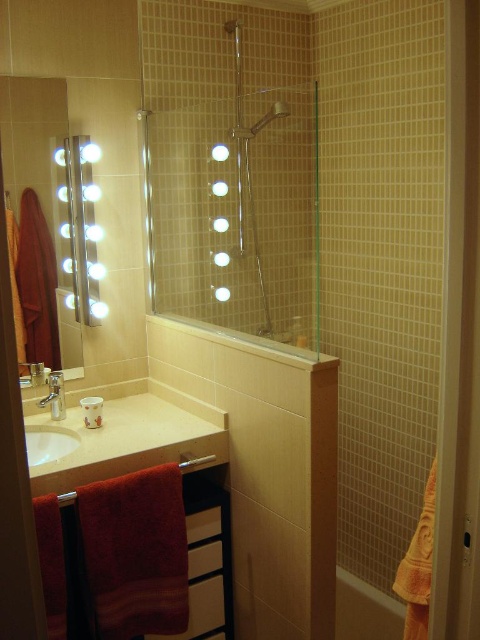
Which is below, white glossy bath at lower right or brushed metal faucet at sink left?

white glossy bath at lower right

Is white glossy bath at lower right positioned behind brushed metal faucet at sink left?

Yes, white glossy bath at lower right is further from the viewer.

I want to click on white glossy bath at lower right, so click(x=364, y=611).

Can you confirm if white glossy sink at lower left is bigger than red fabric towel bar at lower left?

Correct, white glossy sink at lower left is larger in size than red fabric towel bar at lower left.

Consider the image. Is white glossy sink at lower left shorter than red fabric towel bar at lower left?

In fact, white glossy sink at lower left may be taller than red fabric towel bar at lower left.

At what (x,y) coordinates should I click in order to perform the action: click on white glossy sink at lower left. Please return your answer as a coordinate pair (x, y). Image resolution: width=480 pixels, height=640 pixels. Looking at the image, I should click on (48, 444).

Does transparent glass shower door at upper center appear over white glossy sink at lower left?

Correct, transparent glass shower door at upper center is located above white glossy sink at lower left.

Is point (222, 97) closer to viewer compared to point (44, 438)?

No, (222, 97) is behind (44, 438).

What are the coordinates of `transparent glass shower door at upper center` in the screenshot? It's located at (228, 182).

Where is `transparent glass shower door at upper center`? transparent glass shower door at upper center is located at coordinates (228, 182).